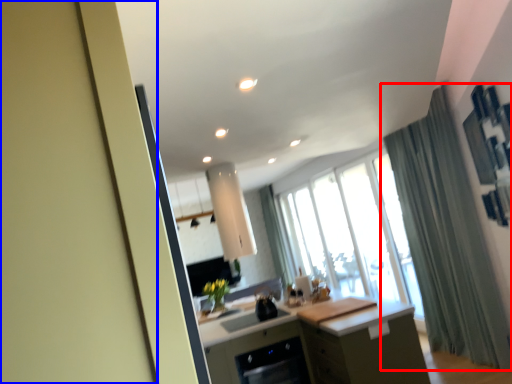
Question: Among these objects, which one is farthest to the camera, curtain (highlighted by a red box) or screen door (highlighted by a blue box)?

Choices:
 (A) curtain
 (B) screen door

Answer: (A)